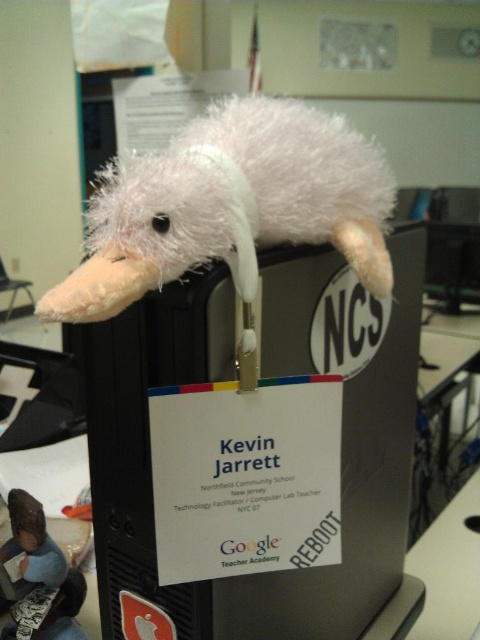
You are organizing a classroom and need to place a new poster on the wall behind the black matte computer at center and the white fluffy kiwi at upper center. Where should you position the poster so it is centered between them?

The black matte computer at center is much taller than the white fluffy kiwi at upper center. To center the poster between them, position it closer to the white fluffy kiwi at upper center since the computer is taller and would require more space below it.

In the scene shown: You are a student who wants to place a 6 inch ruler between the black matte computer at center and the white fluffy kiwi at upper center. Will the ruler fit between them?

The black matte computer at center and the white fluffy kiwi at upper center are 5.61 inches apart from each other. Since the ruler is 6 inches long, it will not fit between them because the distance is shorter than the ruler.

You are a student at NCS who wants to place a new keyboard on the desk next to the black matte computer at center. The keyboard requires 12 inches of space between the computer and the edge of the desk. Can the keyboard fit in the available space if the fluffy white plush toy at upper center is currently occupying some of that space?

The black matte computer at center and fluffy white plush toy at upper center are 11.75 inches apart. Since the required space for the keyboard is 12 inches, the current distance is insufficient. The keyboard cannot fit without moving the plush toy.